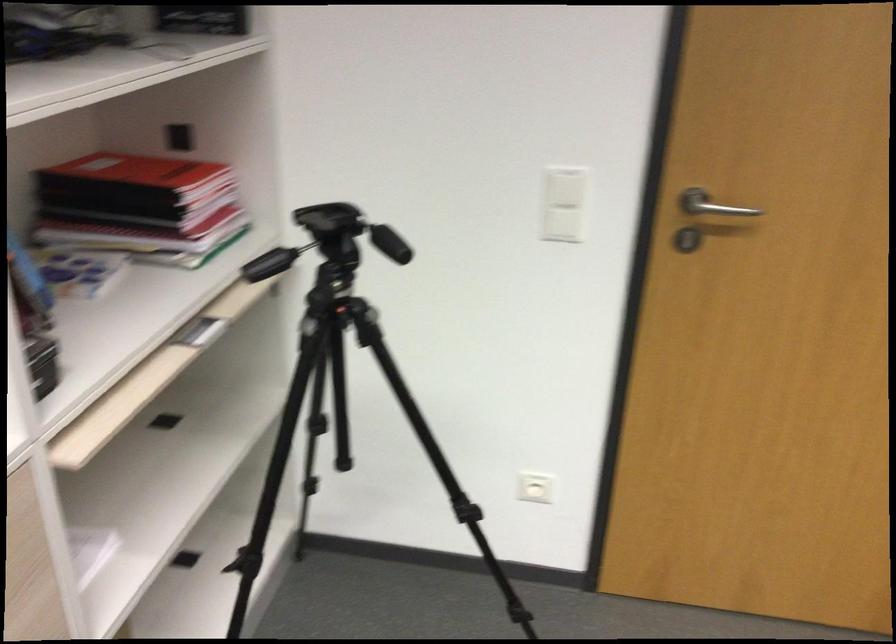
The location [133,172] corresponds to which object?

This point indicates the red notebook.